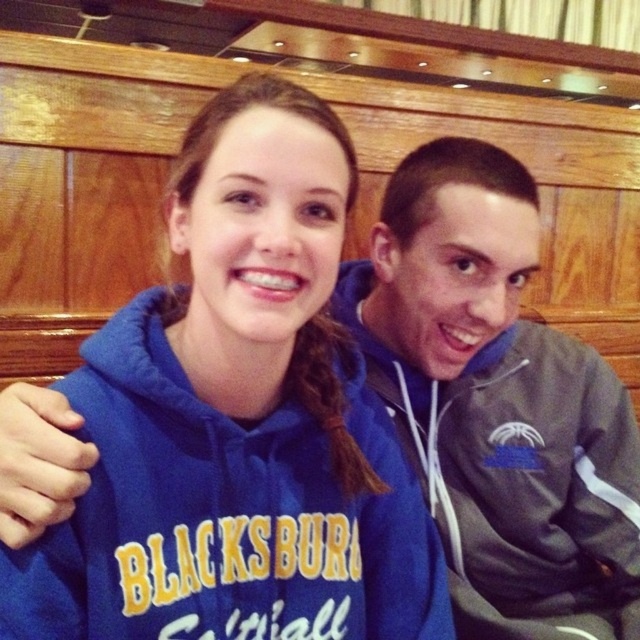
You are trying to decide which piece of clothing to wear for a cold day. You have the blue fleece sweatshirt at center and the gray fleece jacket at center. Based on their thickness, which one would provide better insulation?

The gray fleece jacket at center is thicker than the blue fleece sweatshirt at center, so it would provide better insulation for a cold day.

You are a photographer trying to capture a candid shot of both the blue fleece sweatshirt at center and the gray fleece jacket at center. Since you want to ensure both are in focus, you need to know their vertical positions. Can you determine which one is higher up in the frame?

The blue fleece sweatshirt at center is located above the gray fleece jacket at center, so it is higher up in the frame.

You are a photographer who needs to capture a clear shot of both the blue fleece sweatshirt at center and the gray fleece jacket at center. Since you can only focus on one clothing item at a time, which one should you focus on first to ensure the other is still in the frame?

You should focus on the blue fleece sweatshirt at center first because it is positioned to the left of the gray fleece jacket at center, so by focusing on the leftmost item, the rightward item will still be within the frame.